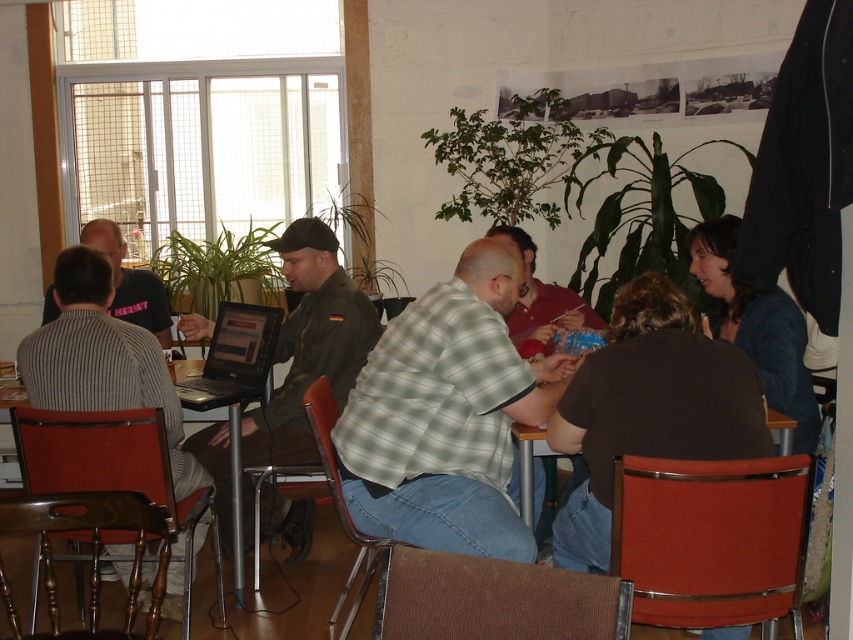
You are a delivery robot with a package that needs to be placed between the silver metallic laptop at center and the matte green shirt at center. The package is 40 inches long. Can you fit the package between them without moving either object?

The distance between the silver metallic laptop at center and the matte green shirt at center is 39.21 inches. Since the package is 40 inches long, it cannot fit between them as the space is slightly smaller than the package.

You are standing in the room and want to move from the point at coordinates point (x=473, y=406) to the point at coordinates point (x=16, y=406). Which direction should you move to get closer to your destination?

To move from point (x=473, y=406) to point (x=16, y=406), you should move downward since point (x=473, y=406) is closer to the viewer than point (x=16, y=406), meaning it is located higher up in the room.